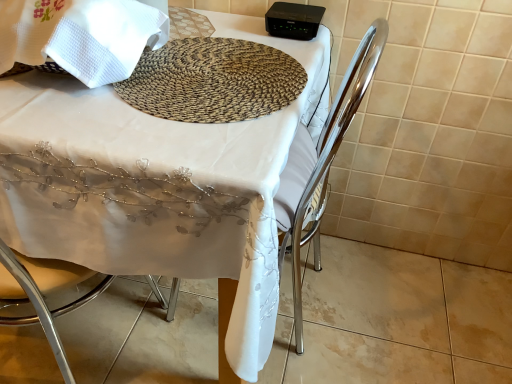
Question: In the image, is white fabric table at center positioned in front of or behind woven natural fiber mat at center?

Choices:
 (A) front
 (B) behind

Answer: (A)

Question: Is white fabric table at center inside the boundaries of woven natural fiber mat at center, or outside?

Choices:
 (A) outside
 (B) inside

Answer: (A)

Question: Based on their relative distances, which object is farther from the white fabric table at center?

Choices:
 (A) metallic silver chair at center
 (B) woven natural fiber mat at center

Answer: (A)

Question: Estimate the real-world distances between objects in this image. Which object is farther from the woven natural fiber mat at center?

Choices:
 (A) white fabric table at center
 (B) metallic silver chair at center

Answer: (B)